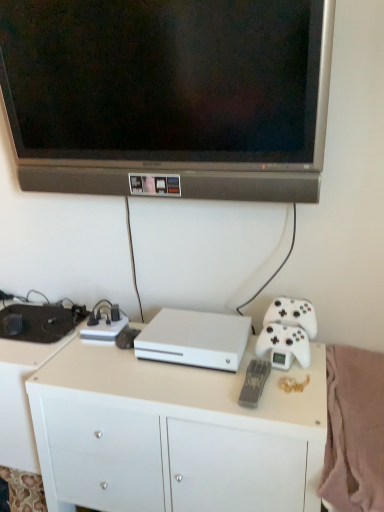
Where is `blank space situated above white matte desk at center, positioned as the 1th desk in right-to-left order (from a real-world perspective)`? The width and height of the screenshot is (384, 512). blank space situated above white matte desk at center, positioned as the 1th desk in right-to-left order (from a real-world perspective) is located at coordinates (191, 368).